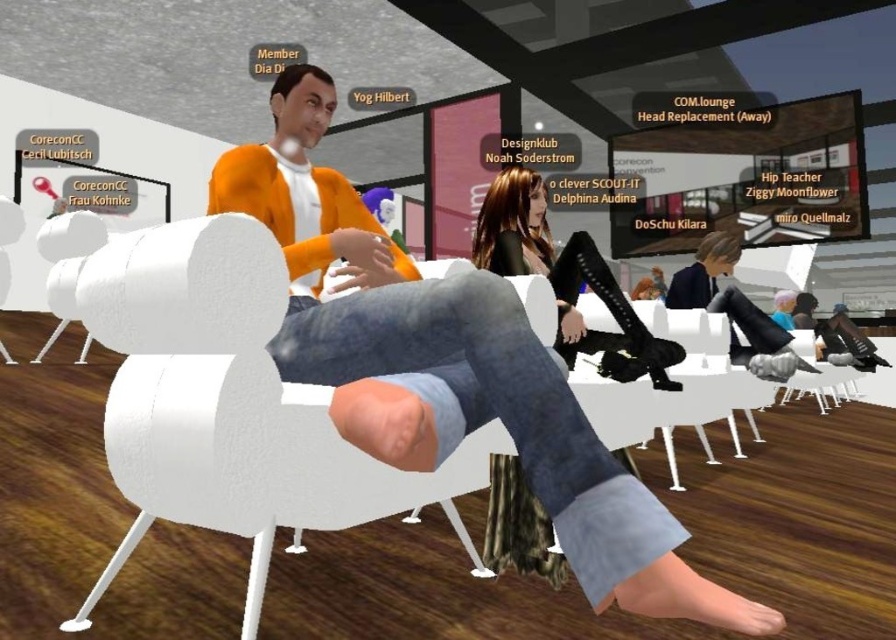
Question: Estimate the real-world distances between objects in this image. Which object is closer to the white matte chair at center?

Choices:
 (A) shiny black leggings at center
 (B) orange cotton sweater at center

Answer: (B)

Question: Which of the following is the closest to the observer?

Choices:
 (A) (556, 289)
 (B) (337, 342)
 (C) (140, 400)

Answer: (C)

Question: Is orange cotton sweater at center above white matte chair at center?

Choices:
 (A) yes
 (B) no

Answer: (A)

Question: Which object is farther from the camera taking this photo?

Choices:
 (A) white matte chair at center
 (B) orange cotton sweater at center

Answer: (A)

Question: Does white matte chair at center have a lesser width compared to shiny black leggings at center?

Choices:
 (A) no
 (B) yes

Answer: (A)

Question: In this image, where is orange cotton sweater at center located relative to shiny black leggings at center?

Choices:
 (A) right
 (B) left

Answer: (B)